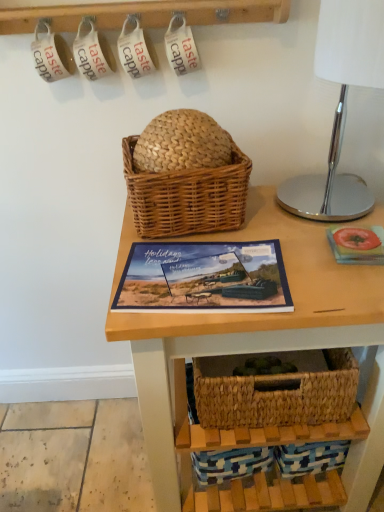
This screenshot has height=512, width=384. Find the location of `free space above woven wood table at center (from a real-world perspective)`. free space above woven wood table at center (from a real-world perspective) is located at coordinates (261, 245).